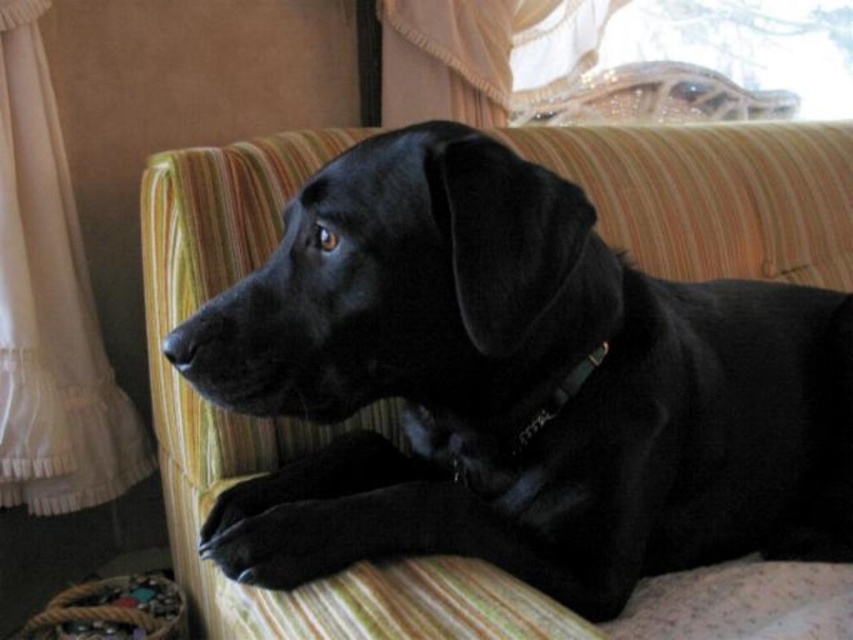
You are standing in the room and want to pet the shiny black dog at center. Based on its position, where should you approach from to reach it?

The shiny black dog at center is located at point 0.603 on the x and y coordinates, which places it near the center of the image. Since it is centered, you can approach from any direction as it is in the middle of the room.

You are a photographer setting up a shoot in this room. You have a camera on a tripod positioned to capture the shiny black dog at center. To ensure proper lighting, you need to know if the white sheer curtain at left is casting a shadow over the dog. Based on their positions, can you determine if the curtain is above the dog?

The shiny black dog at center is located below the white sheer curtain at left, so the curtain is above the dog. This means the curtain could potentially cast a shadow over the dog depending on the light direction.

You are a photographer standing in front of the shiny black dog at center. You want to take a closeup photo of the dog without getting too close. What is the minimum distance you need to maintain to ensure the dog remains in focus?

The shiny black dog at center is 66.63 centimeters away from viewer, so you need to maintain a minimum distance of 66.63 centimeters to ensure the dog stays in focus.